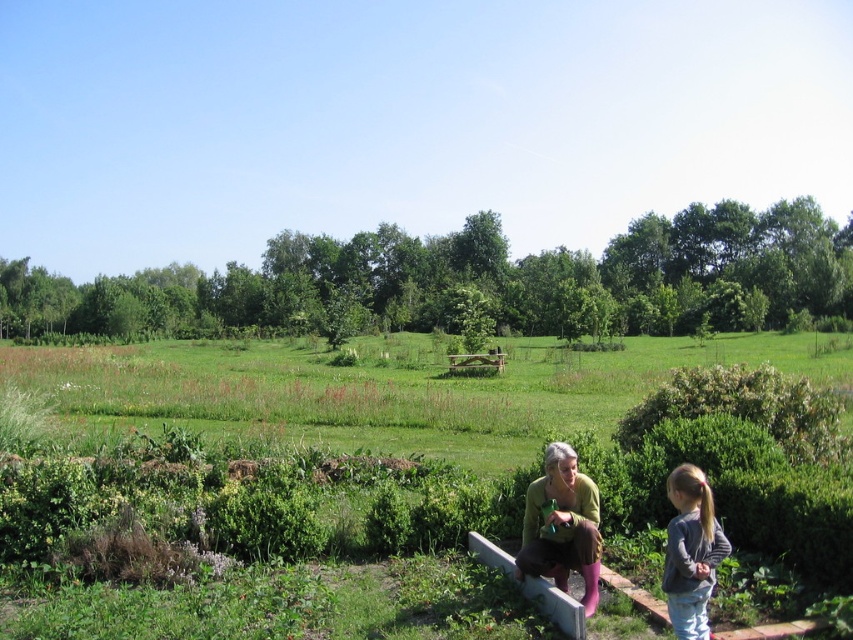
Question: From the image, what is the correct spatial relationship of green grass at lower center in relation to green leafy hedge at center?

Choices:
 (A) above
 (B) below

Answer: (B)

Question: Estimate the real-world distances between objects in this image. Which object is farther from the gray fleece jacket at lower right?

Choices:
 (A) green grass at lower center
 (B) green leafy hedge at center
 (C) green knitted sweater at lower center

Answer: (B)

Question: Which object is farther from the camera taking this photo?

Choices:
 (A) green grass at lower center
 (B) green knitted sweater at lower center
 (C) gray fleece jacket at lower right
 (D) green leafy hedge at center

Answer: (D)

Question: Observing the image, what is the correct spatial positioning of green leafy hedge at center in reference to green knitted sweater at lower center?

Choices:
 (A) above
 (B) below

Answer: (A)

Question: Does green leafy hedge at center appear under gray fleece jacket at lower right?

Choices:
 (A) yes
 (B) no

Answer: (B)

Question: Which point appears farthest from the camera in this image?

Choices:
 (A) (474, 440)
 (B) (585, 301)
 (C) (566, 490)
 (D) (688, 632)

Answer: (B)